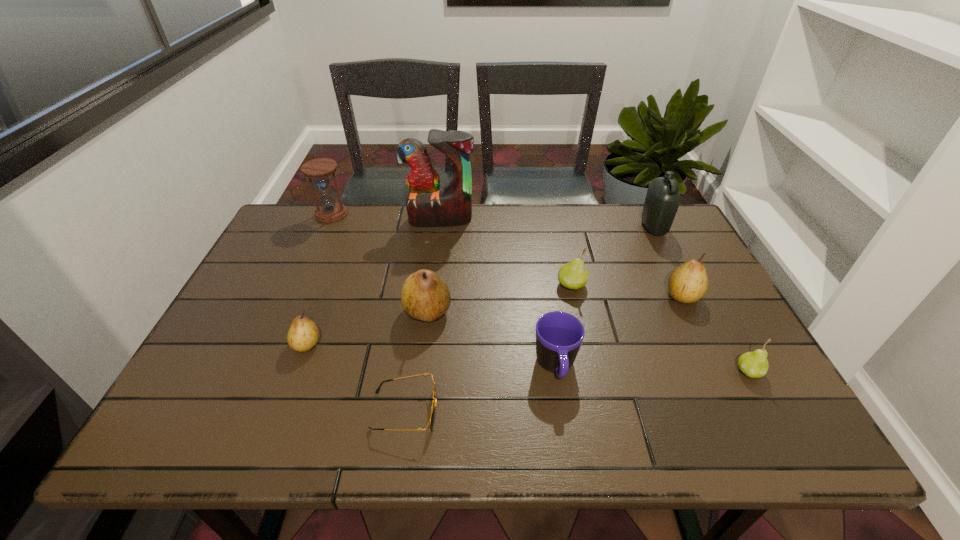
The width and height of the screenshot is (960, 540). I want to click on blank region between the biggest brown pear and the hourglass, so click(x=379, y=263).

Where is `empty space that is in between the hourglass and the tallest object`? The width and height of the screenshot is (960, 540). empty space that is in between the hourglass and the tallest object is located at coordinates (386, 217).

Locate an element on the screen. Image resolution: width=960 pixels, height=540 pixels. vacant area between the hourglass and the tallest object is located at coordinates (386, 217).

This screenshot has height=540, width=960. I want to click on empty space that is in between the right green pear and the second pear from left to right, so click(x=588, y=341).

Identify the location of object that is the closest to the biggest brown pear. The image size is (960, 540). (433, 409).

Select which object appears as the closest to the second smallest brown pear. Please provide its 2D coordinates. Your answer should be formatted as a tuple, i.e. [(x, y)], where the tuple contains the x and y coordinates of a point satisfying the conditions above.

[(754, 364)]

Select which pear appears as the second closest to the shortest object. Please provide its 2D coordinates. Your answer should be formatted as a tuple, i.e. [(x, y)], where the tuple contains the x and y coordinates of a point satisfying the conditions above.

[(303, 334)]

In order to click on pear object that ranks as the second closest to the mug in this screenshot , I will do `click(425, 296)`.

The width and height of the screenshot is (960, 540). In order to click on brown pear that is the closest one to the black mug in this screenshot , I will do `click(425, 296)`.

Point out which brown pear is positioned as the nearest to the hourglass. Please provide its 2D coordinates. Your answer should be formatted as a tuple, i.e. [(x, y)], where the tuple contains the x and y coordinates of a point satisfying the conditions above.

[(425, 296)]